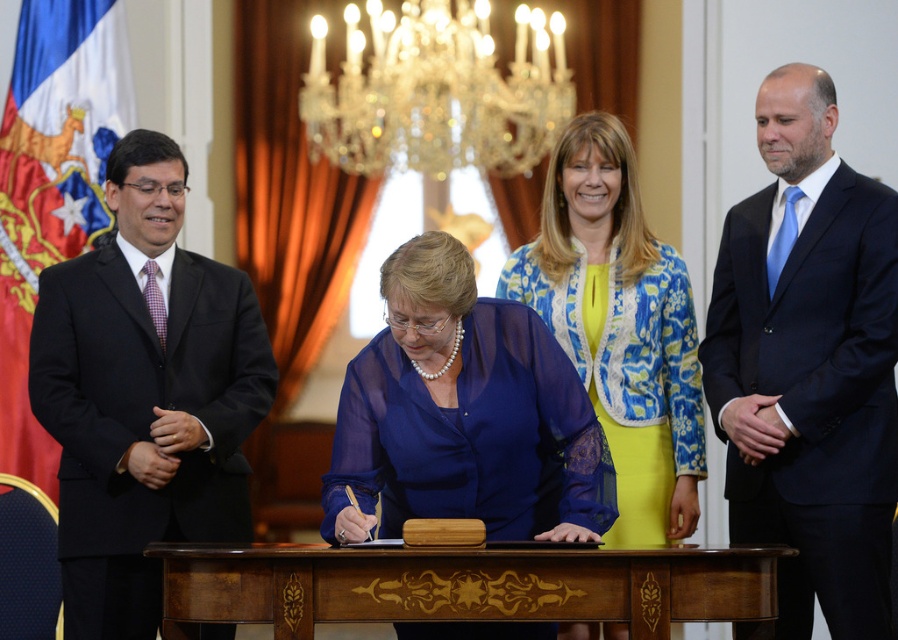
You are an interior designer observing the formal indoor scene. You need to ensure that the blue sheer blouse at center and the blue floral jacket at center are displayed properly in a catalog. Which item should be placed higher on the rack to avoid being obscured by the other?

The blue sheer blouse at center has a lesser height compared to the blue floral jacket at center, so placing the shorter blue sheer blouse at center higher up on the rack will prevent it from being hidden by the taller blue floral jacket at center.

Based on the scene description, where is the black suit at left located in the image?

The black suit at left is located at point 0.617 on the x axis and 0.161 on the y axis.

You are standing at the camera position and want to throw a ball to a point that is 7 meters away from you. Is the point at coordinates point (430, 508) within that range?

The distance of point (430, 508) from camera is 7.65 meters, which is beyond the 7 meters range, so the ball cannot reach it.